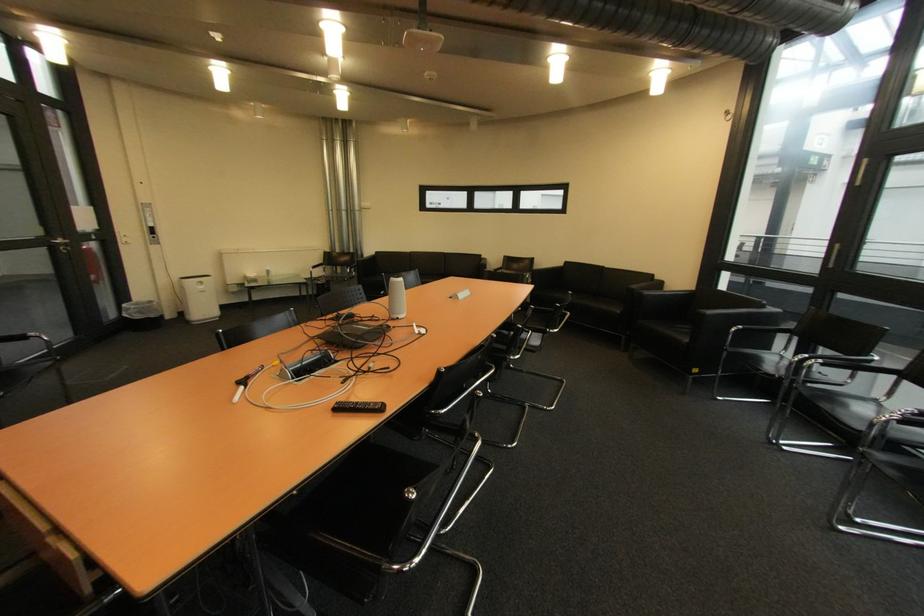
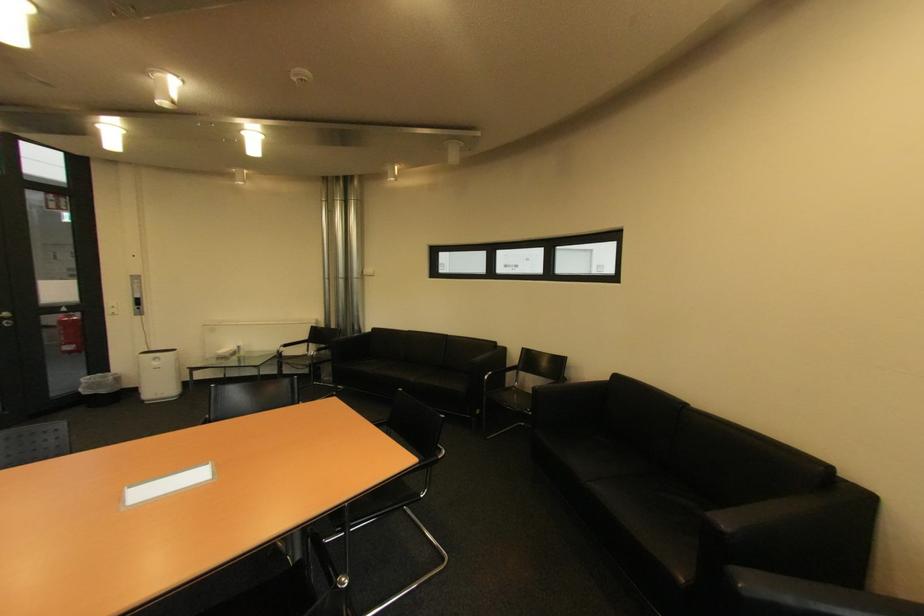
Locate, in the second image, the point that corresponds to the point at 147,318 in the first image.

(94, 394)